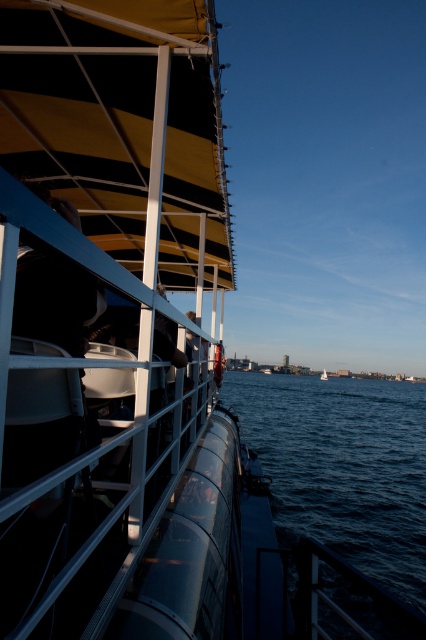
You are standing on the boat deck and want to take a photo of the dark blue water at lower right. Where should you aim your camera to capture the point at coordinates (344, 465)?

The point at coordinates (344, 465) is located on the dark blue water at lower right. Aim your camera towards the lower right area of the scene to capture it.

You are a photographer on the boat deck, and you want to capture a photo where both the dark blue water at lower right and the white glossy sailboat at center are visible. Which object should be placed closer to the edge of the frame to ensure both are fully visible?

The dark blue water at lower right is wider than the white glossy sailboat at center, so to ensure both are fully visible in the photo, position the wider dark blue water at lower right closer to the edge of the frame.

You are standing on the boat deck and want to take a photo of both the point at coordinates point (262, 417) and the point at coordinates point (322, 376). Which point should you focus on first to ensure both are in focus?

You should focus on the point at coordinates point (262, 417) first because it is closer to the camera than the point at coordinates point (322, 376). This ensures that both points will be in focus when using a camera with a fixed focal plane.